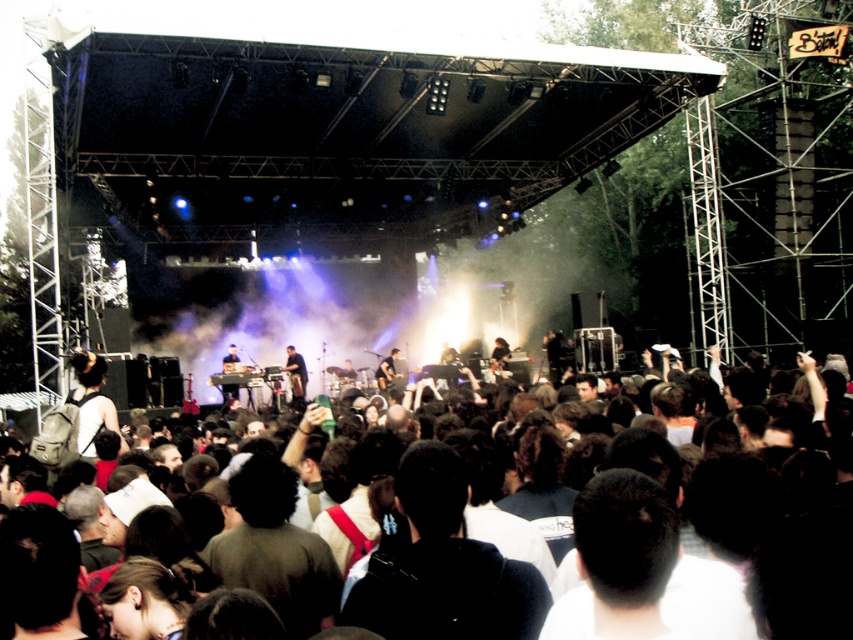
You are a photographer trying to capture a clear shot of the dark clothing at center and the dark brown leather guitar at center. Since the stage is very crowded, you need to know their positions relative to each other. Which object is on the left side?

The dark clothing at center is positioned on the left side of the dark brown leather guitar at center.

You are a photographer at the concert and want to capture a photo of both the dark brown hair at center and the dark brown leather guitar at center in the same frame. Based on their positions, which object should you position your camera closer to in order to include both in the shot?

You should position your camera closer to the dark brown leather guitar at center because the dark brown hair at center is to the left of it, so adjusting the camera angle towards the guitar will help capture both objects in the frame.